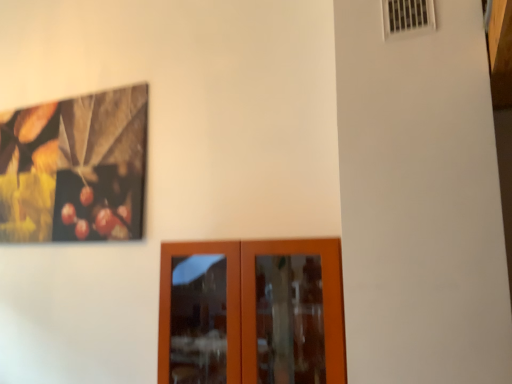
Question: Does white plastic air conditioning at upper right have a greater width compared to brown wooden door at lower center?

Choices:
 (A) yes
 (B) no

Answer: (B)

Question: Does white plastic air conditioning at upper right have a lesser height compared to brown wooden door at lower center?

Choices:
 (A) no
 (B) yes

Answer: (B)

Question: Is white plastic air conditioning at upper right at the right side of brown wooden door at lower center?

Choices:
 (A) no
 (B) yes

Answer: (B)

Question: Does white plastic air conditioning at upper right have a lesser width compared to brown wooden door at lower center?

Choices:
 (A) yes
 (B) no

Answer: (A)

Question: From the image's perspective, is white plastic air conditioning at upper right under brown wooden door at lower center?

Choices:
 (A) yes
 (B) no

Answer: (B)

Question: Does white plastic air conditioning at upper right have a greater height compared to brown wooden door at lower center?

Choices:
 (A) no
 (B) yes

Answer: (A)

Question: Is the depth of brown wooden door at lower center greater than that of white plastic air conditioning at upper right?

Choices:
 (A) no
 (B) yes

Answer: (B)

Question: Considering the relative sizes of brown wooden door at lower center and white plastic air conditioning at upper right in the image provided, is brown wooden door at lower center bigger than white plastic air conditioning at upper right?

Choices:
 (A) no
 (B) yes

Answer: (B)

Question: Does brown wooden door at lower center lie in front of white plastic air conditioning at upper right?

Choices:
 (A) yes
 (B) no

Answer: (B)

Question: Is brown wooden door at lower center positioned with its back to white plastic air conditioning at upper right?

Choices:
 (A) yes
 (B) no

Answer: (B)

Question: Would you consider brown wooden door at lower center to be distant from white plastic air conditioning at upper right?

Choices:
 (A) yes
 (B) no

Answer: (A)

Question: Are brown wooden door at lower center and white plastic air conditioning at upper right beside each other?

Choices:
 (A) yes
 (B) no

Answer: (B)

Question: Looking at their shapes, would you say white plastic air conditioning at upper right is wider or thinner than brown wooden door at lower center?

Choices:
 (A) wide
 (B) thin

Answer: (B)